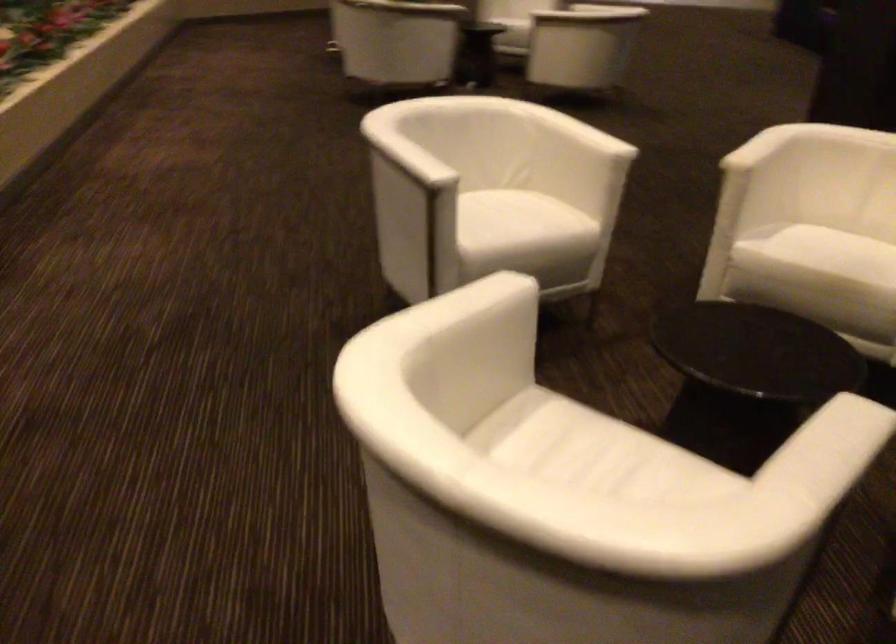
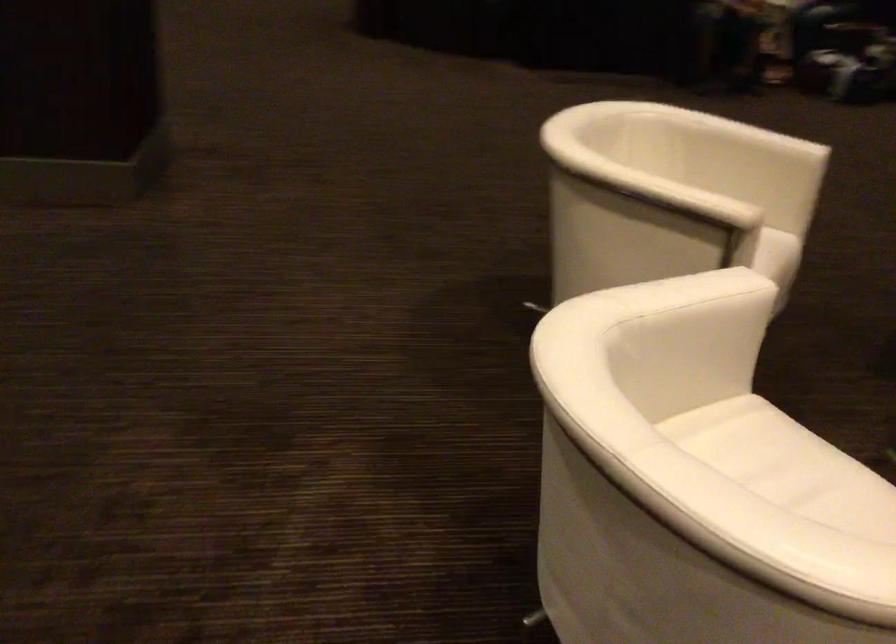
Find the pixel in the second image that matches pixel 734 196 in the first image.

(676, 261)